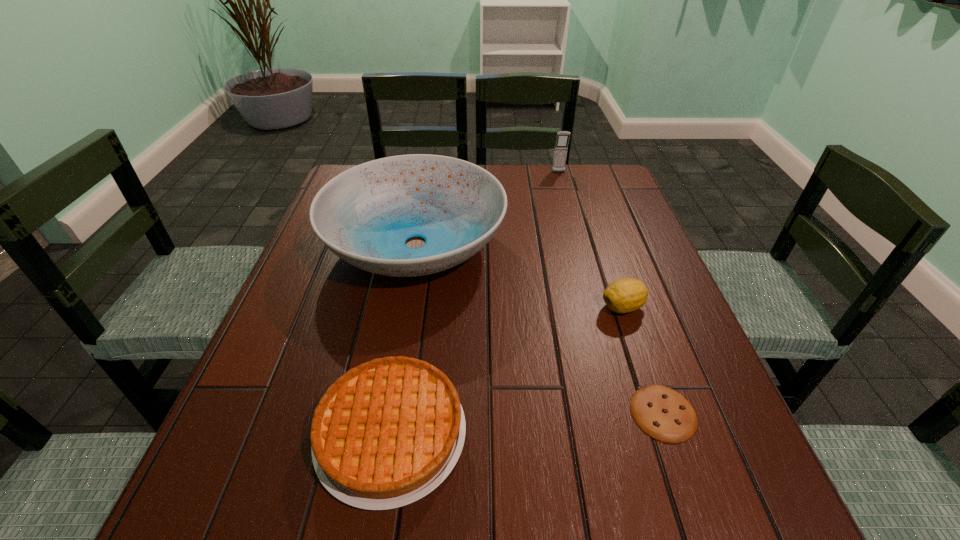
The image size is (960, 540). What are the coordinates of `object that is at the far left corner` in the screenshot? It's located at (364, 215).

Locate an element on the screen. Image resolution: width=960 pixels, height=540 pixels. object at the near left corner is located at coordinates pyautogui.click(x=386, y=433).

Locate an element on the screen. object positioned at the far right corner is located at coordinates (561, 146).

This screenshot has height=540, width=960. Identify the location of blank space at the near edge of the desktop. (437, 504).

Where is `vacant area at the left edge of the desktop`? This screenshot has width=960, height=540. vacant area at the left edge of the desktop is located at coordinates (318, 257).

This screenshot has width=960, height=540. In order to click on vacant space at the right edge in this screenshot , I will do `click(713, 379)`.

Identify the location of vacant space that is in between the lemon and the dish. pos(519,275).

Find the location of a particular element. free space between the dish and the third tallest object is located at coordinates (519, 275).

Where is `unoccupied area between the pie and the shortest object`? This screenshot has height=540, width=960. unoccupied area between the pie and the shortest object is located at coordinates (527, 423).

This screenshot has height=540, width=960. In order to click on free space between the third shortest object and the cookie in this screenshot , I will do `click(643, 360)`.